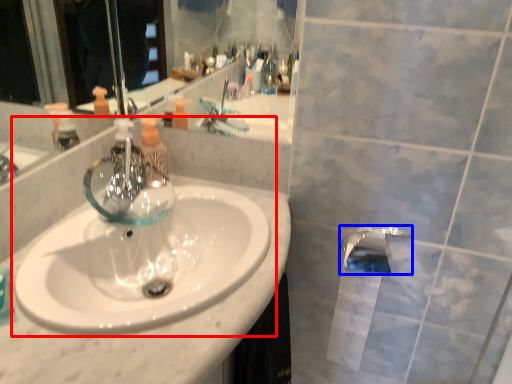
Question: Which of the following is the closest to the observer, sink (highlighted by a red box) or tap (highlighted by a blue box)?

Choices:
 (A) sink
 (B) tap

Answer: (A)